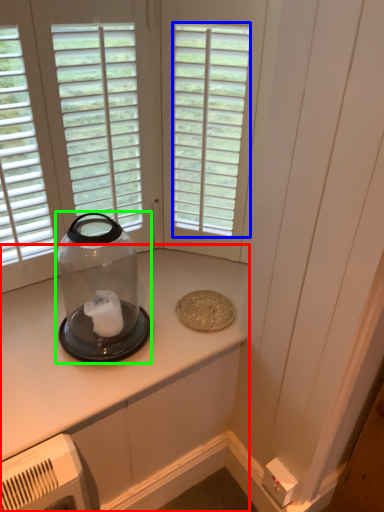
Question: Which is farther away from countertop (highlighted by a red box)? window (highlighted by a blue box) or glass bottle (highlighted by a green box)?

Choices:
 (A) window
 (B) glass bottle

Answer: (A)